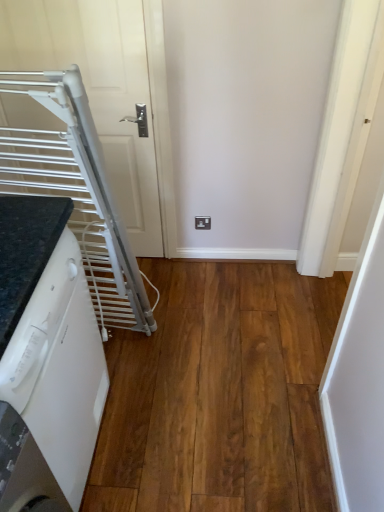
This screenshot has width=384, height=512. Identify the location of brown wood flooring at lower left. (220, 394).

What do you see at coordinates (58, 376) in the screenshot?
I see `white glossy dishwasher at lower left` at bounding box center [58, 376].

Find the location of a particular element. The height and width of the screenshot is (512, 384). brown wood flooring at lower left is located at coordinates (220, 394).

I want to click on home appliance lying below the white matte door at upper left (from the image's perspective), so click(58, 376).

From the image's perspective, is white glossy dishwasher at lower left positioned above or below white matte door at upper left?

white glossy dishwasher at lower left is situated lower than white matte door at upper left in the image.

Looking at their sizes, would you say white glossy dishwasher at lower left is wider or thinner than white matte door at upper left?

In the image, white glossy dishwasher at lower left appears to be wider than white matte door at upper left.

Considering the relative sizes of white glossy dishwasher at lower left and white matte door at upper left in the image provided, is white glossy dishwasher at lower left taller than white matte door at upper left?

Incorrect, the height of white glossy dishwasher at lower left is not larger of that of white matte door at upper left.

From the picture: Can you tell me how much white glossy dishwasher at lower left and brown wood flooring at lower left differ in facing direction?

The angular difference between white glossy dishwasher at lower left and brown wood flooring at lower left is 1.64 degrees.

Which object is positioned more to the right, white glossy dishwasher at lower left or brown wood flooring at lower left?

Positioned to the right is brown wood flooring at lower left.

Is point (68, 463) behind point (228, 298)?

No, it is not.

Can you confirm if white glossy dishwasher at lower left is smaller than brown wood flooring at lower left?

No, white glossy dishwasher at lower left is not smaller than brown wood flooring at lower left.

Is brown wood flooring at lower left taller than white matte door at upper left?

No.

Consider the image. How different are the orientations of brown wood flooring at lower left and white matte door at upper left in degrees?

They differ by 90 degrees in their facing directions.

Looking at this image, is brown wood flooring at lower left inside or outside of white matte door at upper left?

brown wood flooring at lower left is not inside white matte door at upper left, it's outside.

Considering the positions of objects brown wood flooring at lower left and white matte door at upper left in the image provided, who is behind, brown wood flooring at lower left or white matte door at upper left?

white matte door at upper left is more distant.

At what (x,y) coordinates should I click in order to perform the action: click on door behind the brown wood flooring at lower left. Please return your answer as a coordinate pair (x, y). This screenshot has width=384, height=512. Looking at the image, I should click on pos(98,89).

From a real-world perspective, which is physically below, white matte door at upper left or brown wood flooring at lower left?

brown wood flooring at lower left, from a real-world perspective.

Is white matte door at upper left directly adjacent to brown wood flooring at lower left?

No, white matte door at upper left is not making contact with brown wood flooring at lower left.

Does white matte door at upper left have a lesser width compared to brown wood flooring at lower left?

Yes.

Looking at the image, does white matte door at upper left seem bigger or smaller compared to white glossy dishwasher at lower left?

Clearly, white matte door at upper left is smaller in size than white glossy dishwasher at lower left.

Looking at their sizes, would you say white matte door at upper left is wider or thinner than white glossy dishwasher at lower left?

white matte door at upper left is thinner than white glossy dishwasher at lower left.

From the picture: Is white matte door at upper left not within white glossy dishwasher at lower left?

white matte door at upper left lies outside white glossy dishwasher at lower left's area.

Can you confirm if brown wood flooring at lower left is smaller than white glossy dishwasher at lower left?

Correct, brown wood flooring at lower left occupies less space than white glossy dishwasher at lower left.

Is brown wood flooring at lower left positioned behind white glossy dishwasher at lower left?

Yes, it is behind white glossy dishwasher at lower left.

Which is closer, (149, 348) or (93, 435)?

Point (149, 348) appears to be farther away from the viewer than point (93, 435).

You are a GUI agent. You are given a task and a screenshot of the screen. Output one action in this format:
    pyautogui.click(x=<x>, y=<y>)
    Task: Click on the home appliance that is below the white matte door at upper left (from the image's perspective)
    The image size is (384, 512).
    Given the screenshot: What is the action you would take?
    pyautogui.click(x=58, y=376)

At what (x,y) coordinates should I click in order to perform the action: click on hardwood on the right side of white glossy dishwasher at lower left. Please return your answer as a coordinate pair (x, y). This screenshot has width=384, height=512. Looking at the image, I should click on (220, 394).

From the image, which object appears to be farther from white glossy dishwasher at lower left, white matte door at upper left or brown wood flooring at lower left?

white matte door at upper left is positioned further to the anchor white glossy dishwasher at lower left.

Looking at the image, which one is located further to white matte door at upper left, brown wood flooring at lower left or white glossy dishwasher at lower left?

white glossy dishwasher at lower left is positioned further to the anchor white matte door at upper left.

When comparing their distances from white glossy dishwasher at lower left, does brown wood flooring at lower left or white matte door at upper left seem further?

Among the two, white matte door at upper left is located further to white glossy dishwasher at lower left.

Consider the image. Considering their positions, is white glossy dishwasher at lower left positioned further to brown wood flooring at lower left than white matte door at upper left?

white matte door at upper left is further to brown wood flooring at lower left.

Estimate the real-world distances between objects in this image. Which object is closer to brown wood flooring at lower left, white matte door at upper left or white glossy dishwasher at lower left?

The object closer to brown wood flooring at lower left is white glossy dishwasher at lower left.

Estimate the real-world distances between objects in this image. Which object is further from white matte door at upper left, white glossy dishwasher at lower left or brown wood flooring at lower left?

white glossy dishwasher at lower left.

Find the location of a particular element. Image resolution: width=384 pixels, height=512 pixels. home appliance between white matte door at upper left and brown wood flooring at lower left from top to bottom is located at coordinates (58, 376).